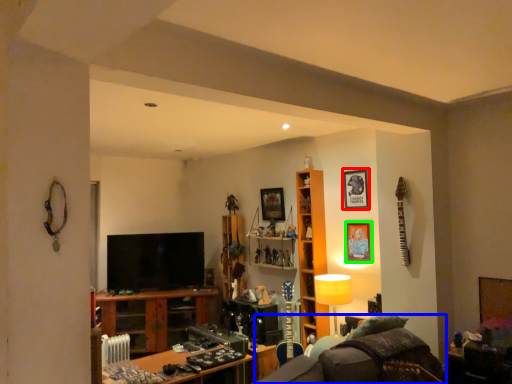
Question: Based on their relative distances, which object is nearer to picture frame (highlighted by a red box)? Choose from swivel chair (highlighted by a blue box) and picture frame (highlighted by a green box).

Choices:
 (A) swivel chair
 (B) picture frame

Answer: (B)